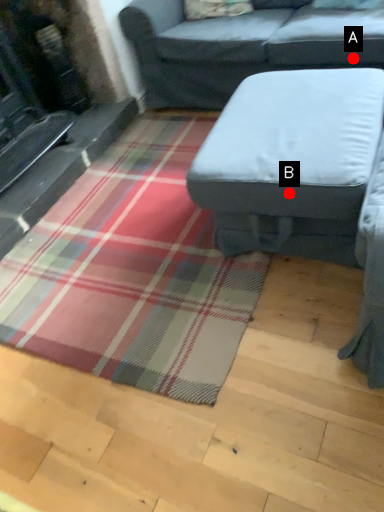
Question: Two points are circled on the image, labeled by A and B beside each circle. Which point is farther to the camera?

Choices:
 (A) A is further
 (B) B is further

Answer: (A)